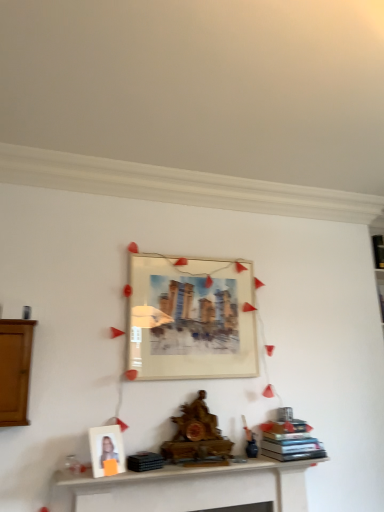
Question: Considering their positions, is matte paper picture frame at center located in front of or behind matte white picture frame at center, which ranks as the first picture frame in right-to-left order?

Choices:
 (A) front
 (B) behind

Answer: (A)

Question: Is point pyautogui.click(x=332, y=384) closer or farther from the camera than point pyautogui.click(x=231, y=288)?

Choices:
 (A) closer
 (B) farther

Answer: (B)

Question: Which object is the closest to the white wooden shelf at lower center?

Choices:
 (A) hardcover books at center, which is counted as the first book, starting from the front
 (B) brown wooden cabinet at left
 (C) wooden statue at center
 (D) matte white picture frame at center, which ranks as the first picture frame in right-to-left order
 (E) white matte picture frame at lower left, the second picture frame viewed from the right

Answer: (C)

Question: Which object is the farthest from the matte paper picture frame at center?

Choices:
 (A) black matte book at upper right, the first book viewed from the back
 (B) white wooden shelf at lower center
 (C) hardcover books at center, marked as the first book in a left-to-right arrangement
 (D) wooden statue at center
 (E) matte white picture frame at center, the second picture frame positioned from the bottom

Answer: (A)